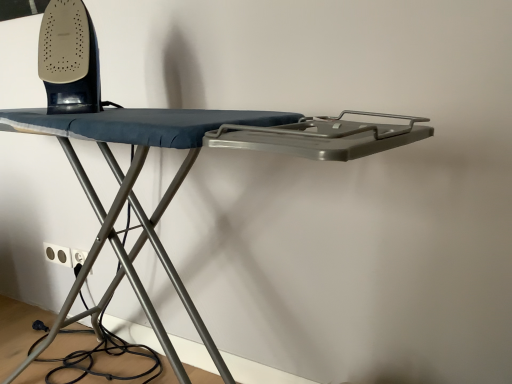
I want to click on white plastic electric outlet at lower left, acting as the second electric outlet starting from the left, so tap(78, 256).

From the image's perspective, between white plastic electric outlet at lower left, acting as the second electric outlet starting from the left, and matte black iron at upper left, who is located below?

white plastic electric outlet at lower left, acting as the second electric outlet starting from the left.

This screenshot has height=384, width=512. In order to click on electric outlet that is the 1st one when counting leftward from the matte black iron at upper left in this screenshot , I will do `click(78, 256)`.

Which of these two, white plastic electric outlet at lower left, which is counted as the 1th electric outlet, starting from the right, or matte black iron at upper left, is thinner?

white plastic electric outlet at lower left, which is counted as the 1th electric outlet, starting from the right, is thinner.

Which of these two, matte black iron at upper left or white plastic electric outlet at lower left, acting as the second electric outlet starting from the left, is bigger?

matte black iron at upper left is bigger.

What's the angular difference between matte black iron at upper left and white plastic electric outlet at lower left, acting as the second electric outlet starting from the left,'s facing directions?

There is a 5.39-degree angle between the facing directions of matte black iron at upper left and white plastic electric outlet at lower left, acting as the second electric outlet starting from the left.

In the scene shown: Based on their positions, is matte black iron at upper left located to the left or right of white plastic electric outlet at lower left, which is counted as the 1th electric outlet, starting from the right?

matte black iron at upper left is to the right of white plastic electric outlet at lower left, which is counted as the 1th electric outlet, starting from the right.

Does white plastic electric outlet at lower left, the first electric outlet in the left-to-right sequence, have a lesser height compared to white plastic electric outlet at lower left, acting as the second electric outlet starting from the left?

Indeed, white plastic electric outlet at lower left, the first electric outlet in the left-to-right sequence, has a lesser height compared to white plastic electric outlet at lower left, acting as the second electric outlet starting from the left.

Is white plastic electric outlet at lower left, which is the 2th electric outlet in right-to-left order, facing away from white plastic electric outlet at lower left, which is counted as the 1th electric outlet, starting from the right?

That's not correct — white plastic electric outlet at lower left, which is the 2th electric outlet in right-to-left order, is not looking away from white plastic electric outlet at lower left, which is counted as the 1th electric outlet, starting from the right.

You are a GUI agent. You are given a task and a screenshot of the screen. Output one action in this format:
    pyautogui.click(x=<x>, y=<y>)
    Task: Click on the electric outlet on the right of white plastic electric outlet at lower left, which is the 2th electric outlet in right-to-left order
    
    Given the screenshot: What is the action you would take?
    pyautogui.click(x=78, y=256)

Relative to white plastic electric outlet at lower left, the first electric outlet in the left-to-right sequence, is white plastic electric outlet at lower left, which is counted as the 1th electric outlet, starting from the right, in front or behind?

Clearly, white plastic electric outlet at lower left, which is counted as the 1th electric outlet, starting from the right, is in front of white plastic electric outlet at lower left, the first electric outlet in the left-to-right sequence.

Consider the image. Is white plastic electric outlet at lower left, which is counted as the 1th electric outlet, starting from the right, outside of white plastic electric outlet at lower left, which is the 2th electric outlet in right-to-left order?

Indeed, white plastic electric outlet at lower left, which is counted as the 1th electric outlet, starting from the right, is completely outside white plastic electric outlet at lower left, which is the 2th electric outlet in right-to-left order.

Considering the points (73, 249) and (65, 253), which point is behind, point (73, 249) or point (65, 253)?

The point (65, 253) is behind.

Considering the relative sizes of white plastic electric outlet at lower left, the first electric outlet in the left-to-right sequence, and matte black iron at upper left in the image provided, is white plastic electric outlet at lower left, the first electric outlet in the left-to-right sequence, thinner than matte black iron at upper left?

Yes, white plastic electric outlet at lower left, the first electric outlet in the left-to-right sequence, is thinner than matte black iron at upper left.

Could you tell me if white plastic electric outlet at lower left, the first electric outlet in the left-to-right sequence, is turned towards matte black iron at upper left?

No.

Considering the sizes of objects white plastic electric outlet at lower left, the first electric outlet in the left-to-right sequence, and matte black iron at upper left in the image provided, who is smaller, white plastic electric outlet at lower left, the first electric outlet in the left-to-right sequence, or matte black iron at upper left?

Smaller between the two is white plastic electric outlet at lower left, the first electric outlet in the left-to-right sequence.

Who is bigger, matte black iron at upper left or white plastic electric outlet at lower left, the first electric outlet in the left-to-right sequence?

With larger size is matte black iron at upper left.

Is there a large distance between matte black iron at upper left and white plastic electric outlet at lower left, the first electric outlet in the left-to-right sequence?

No.

Considering the sizes of matte black iron at upper left and white plastic electric outlet at lower left, the first electric outlet in the left-to-right sequence, in the image, is matte black iron at upper left wider or thinner than white plastic electric outlet at lower left, the first electric outlet in the left-to-right sequence,?

Clearly, matte black iron at upper left has more width compared to white plastic electric outlet at lower left, the first electric outlet in the left-to-right sequence.

Could you tell me if matte black iron at upper left is facing white plastic electric outlet at lower left, which is the 2th electric outlet in right-to-left order?

No, matte black iron at upper left is not oriented towards white plastic electric outlet at lower left, which is the 2th electric outlet in right-to-left order.

Find the location of `equipment above the white plastic electric outlet at lower left, which is counted as the 1th electric outlet, starting from the right (from a real-world perspective)`. equipment above the white plastic electric outlet at lower left, which is counted as the 1th electric outlet, starting from the right (from a real-world perspective) is located at coordinates (69, 59).

The height and width of the screenshot is (384, 512). Find the location of `equipment in front of the white plastic electric outlet at lower left, which is counted as the 1th electric outlet, starting from the right`. equipment in front of the white plastic electric outlet at lower left, which is counted as the 1th electric outlet, starting from the right is located at coordinates 69,59.

When comparing their distances from matte black iron at upper left, does white plastic electric outlet at lower left, which is the 2th electric outlet in right-to-left order, or white plastic electric outlet at lower left, which is counted as the 1th electric outlet, starting from the right, seem further?

The object further to matte black iron at upper left is white plastic electric outlet at lower left, which is the 2th electric outlet in right-to-left order.

Based on their spatial positions, is white plastic electric outlet at lower left, acting as the second electric outlet starting from the left, or white plastic electric outlet at lower left, the first electric outlet in the left-to-right sequence, closer to matte black iron at upper left?

Based on the image, white plastic electric outlet at lower left, acting as the second electric outlet starting from the left, appears to be nearer to matte black iron at upper left.

Considering their positions, is matte black iron at upper left positioned further to white plastic electric outlet at lower left, which is counted as the 1th electric outlet, starting from the right, than white plastic electric outlet at lower left, the first electric outlet in the left-to-right sequence?

matte black iron at upper left is further to white plastic electric outlet at lower left, which is counted as the 1th electric outlet, starting from the right.

Based on their spatial positions, is white plastic electric outlet at lower left, which is counted as the 1th electric outlet, starting from the right, or matte black iron at upper left closer to white plastic electric outlet at lower left, which is the 2th electric outlet in right-to-left order?

white plastic electric outlet at lower left, which is counted as the 1th electric outlet, starting from the right.

Estimate the real-world distances between objects in this image. Which object is further from white plastic electric outlet at lower left, acting as the second electric outlet starting from the left, white plastic electric outlet at lower left, the first electric outlet in the left-to-right sequence, or matte black iron at upper left?

matte black iron at upper left is further to white plastic electric outlet at lower left, acting as the second electric outlet starting from the left.

Based on their spatial positions, is matte black iron at upper left or white plastic electric outlet at lower left, which is counted as the 1th electric outlet, starting from the right, further from white plastic electric outlet at lower left, the first electric outlet in the left-to-right sequence?

Among the two, matte black iron at upper left is located further to white plastic electric outlet at lower left, the first electric outlet in the left-to-right sequence.

I want to click on electric outlet between matte black iron at upper left and white plastic electric outlet at lower left, which is the 2th electric outlet in right-to-left order, in the front-back direction, so click(x=78, y=256).